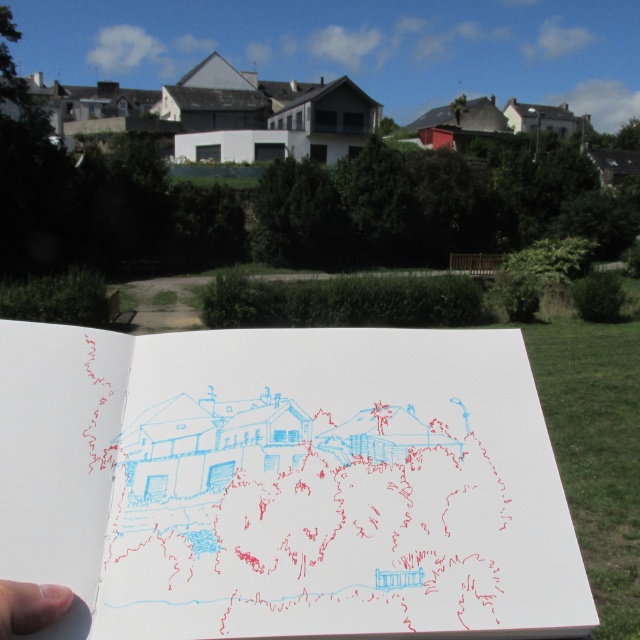
You are standing in the residential area shown in the image. You see a point at coordinates (284,483). What object is located at that point?

The point at coordinates (284,483) corresponds to the white paper at center.

From the picture: You are an artist trying to place a new drawing on your desk. You have a white paper at center and a skinny flesh at lower left in front of you. Which object has a larger height?

The white paper at center has a greater height compared to the skinny flesh at lower left, so the white paper at center is taller.

You are standing at the point with coordinates point (36,618) and want to walk to the point with coordinates point (336,390). Is there any obstacle between you and your destination?

Point (336,390) is behind point (36,618), so there is an obstacle between them.